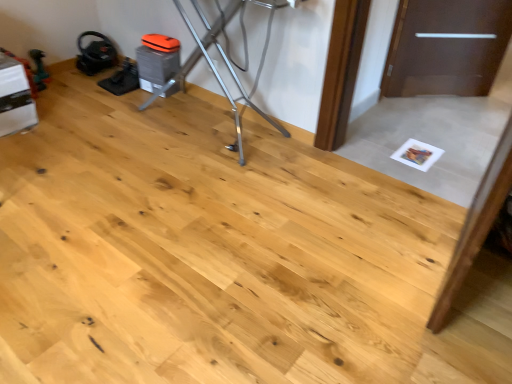
Question: Should I look upward or downward to see metallic silver ironing board at upper center?

Choices:
 (A) down
 (B) up

Answer: (B)

Question: Can you confirm if brown matte door at upper right is taller than metallic silver ironing board at upper center?

Choices:
 (A) no
 (B) yes

Answer: (A)

Question: Is brown matte door at upper right bigger than metallic silver ironing board at upper center?

Choices:
 (A) yes
 (B) no

Answer: (B)

Question: From the image's perspective, is brown matte door at upper right below metallic silver ironing board at upper center?

Choices:
 (A) no
 (B) yes

Answer: (A)

Question: Is brown matte door at upper right aimed at metallic silver ironing board at upper center?

Choices:
 (A) no
 (B) yes

Answer: (A)

Question: Considering the relative positions of brown matte door at upper right and metallic silver ironing board at upper center in the image provided, is brown matte door at upper right in front of metallic silver ironing board at upper center?

Choices:
 (A) no
 (B) yes

Answer: (A)

Question: From a real-world perspective, does brown matte door at upper right sit lower than metallic silver ironing board at upper center?

Choices:
 (A) no
 (B) yes

Answer: (B)

Question: From a real-world perspective, does metallic silver ironing board at upper center sit lower than brown matte door at upper right?

Choices:
 (A) yes
 (B) no

Answer: (B)

Question: Considering the relative sizes of metallic silver ironing board at upper center and brown matte door at upper right in the image provided, is metallic silver ironing board at upper center taller than brown matte door at upper right?

Choices:
 (A) yes
 (B) no

Answer: (A)

Question: Is metallic silver ironing board at upper center outside brown matte door at upper right?

Choices:
 (A) yes
 (B) no

Answer: (A)

Question: Is metallic silver ironing board at upper center surrounding brown matte door at upper right?

Choices:
 (A) yes
 (B) no

Answer: (B)

Question: From the image's perspective, is metallic silver ironing board at upper center on top of brown matte door at upper right?

Choices:
 (A) no
 (B) yes

Answer: (A)

Question: Is metallic silver ironing board at upper center wider than brown matte door at upper right?

Choices:
 (A) yes
 (B) no

Answer: (A)

Question: In terms of height, does metallic silver ironing board at upper center look taller or shorter compared to brown matte door at upper right?

Choices:
 (A) short
 (B) tall

Answer: (B)